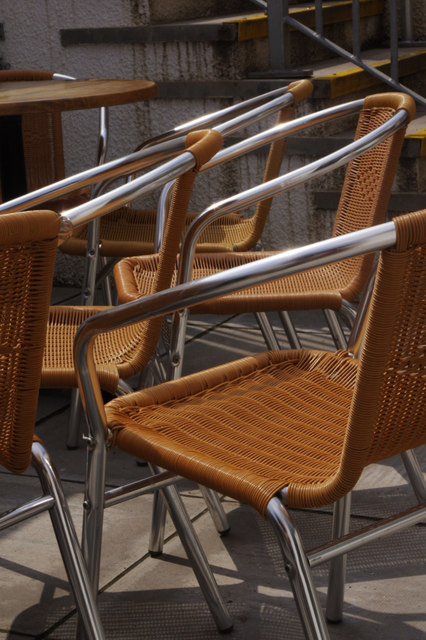
Where is `chairs`? chairs is located at coordinates (384, 330), (7, 259), (169, 244), (360, 205), (280, 153).